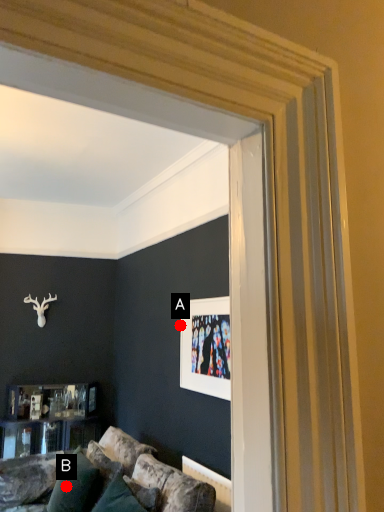
Question: Two points are circled on the image, labeled by A and B beside each circle. Which point appears farthest from the camera in this image?

Choices:
 (A) A is further
 (B) B is further

Answer: (A)